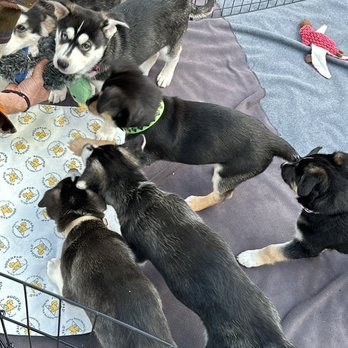
I want to click on dark gray blanket, so click(x=255, y=199).